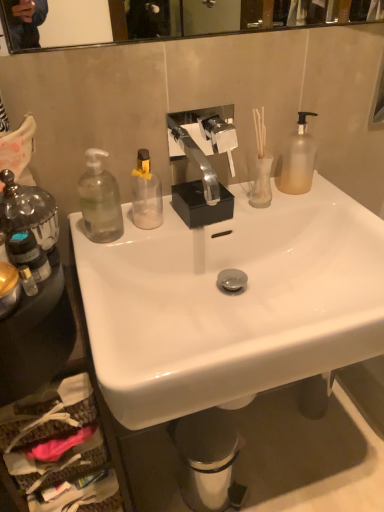
You are a GUI agent. You are given a task and a screenshot of the screen. Output one action in this format:
    pyautogui.click(x=<x>, y=<y>)
    Task: Click on the unoccupied area in front of transparent glass soap dispenser at left, acting as the fourth bottle starting from the left
    This screenshot has width=384, height=512.
    Given the screenshot: What is the action you would take?
    pyautogui.click(x=93, y=278)